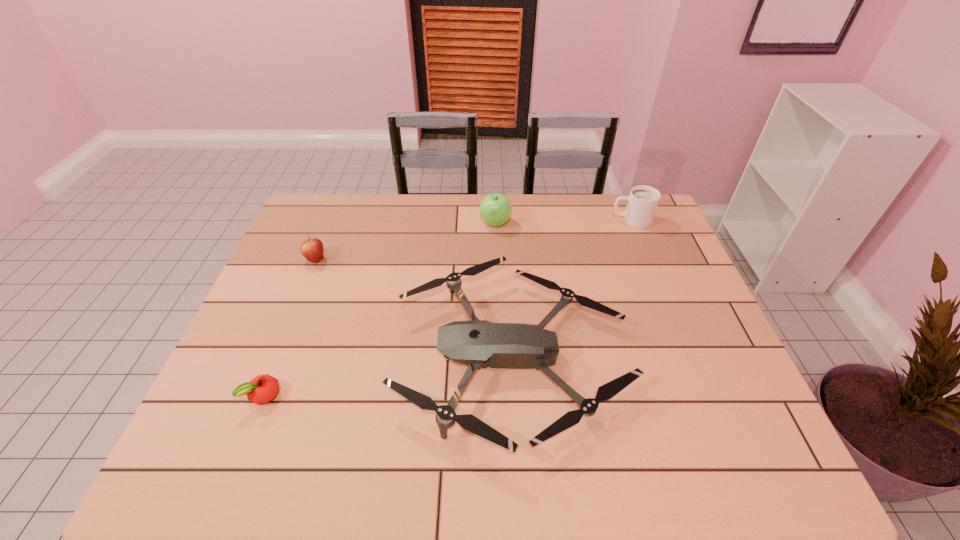
At what (x,y) coordinates should I click in order to perform the action: click on free spot between the shortest object and the cappuccino. Please return your answer as a coordinate pair (x, y). The image size is (960, 540). Looking at the image, I should click on (447, 308).

Identify the location of empty location between the third nearest object and the second shortest object. (414, 308).

Find the location of `vacant point located between the second shortest object and the farthest apple`. vacant point located between the second shortest object and the farthest apple is located at coordinates (504, 289).

Locate an element on the screen. free area in between the farthest apple and the fourth tallest object is located at coordinates (504, 289).

This screenshot has width=960, height=540. What are the coordinates of `free spot between the rightmost apple and the cappuccino` in the screenshot? It's located at (564, 222).

Identify which object is the closest to the drone. Please provide its 2D coordinates. Your answer should be formatted as a tuple, i.e. [(x, y)], where the tuple contains the x and y coordinates of a point satisfying the conditions above.

[(495, 210)]

The image size is (960, 540). I want to click on object that is the third closest one to the rightmost object, so click(x=312, y=249).

Identify which apple is the closest to the third farthest object. Please provide its 2D coordinates. Your answer should be formatted as a tuple, i.e. [(x, y)], where the tuple contains the x and y coordinates of a point satisfying the conditions above.

[(262, 389)]

Identify which apple is the closest to the farthest apple. Please provide its 2D coordinates. Your answer should be formatted as a tuple, i.e. [(x, y)], where the tuple contains the x and y coordinates of a point satisfying the conditions above.

[(312, 249)]